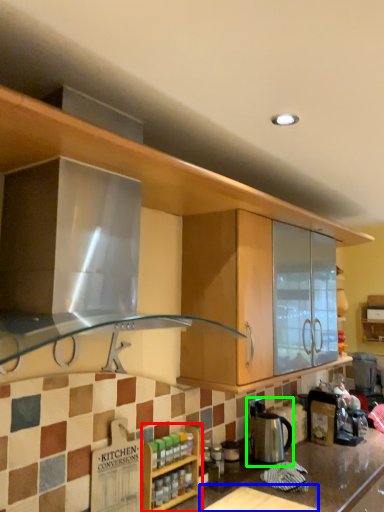
Question: Which object is positioned closest to cabinetry (highlighted by a red box)? Select from table (highlighted by a blue box) and appliance (highlighted by a green box).

Choices:
 (A) table
 (B) appliance

Answer: (A)